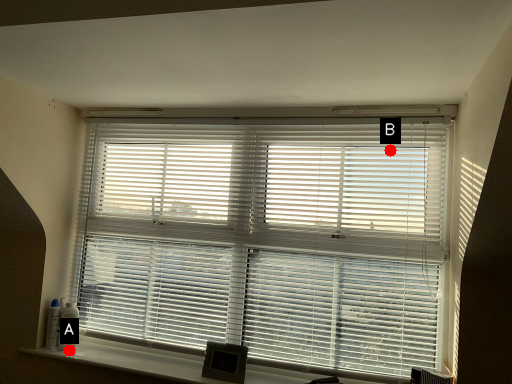
Question: Two points are circled on the image, labeled by A and B beside each circle. Among these points, which one is farthest from the camera?

Choices:
 (A) A is further
 (B) B is further

Answer: (A)